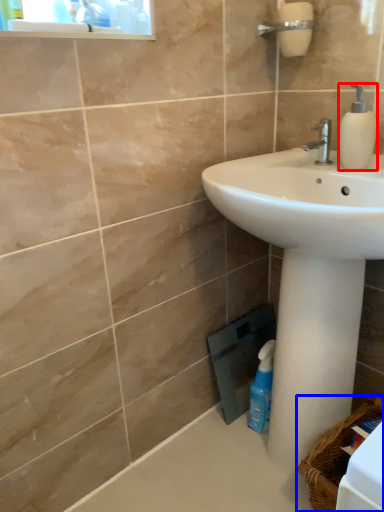
Question: Which object is further to the camera taking this photo, soap dispenser (highlighted by a red box) or basket (highlighted by a blue box)?

Choices:
 (A) soap dispenser
 (B) basket

Answer: (A)